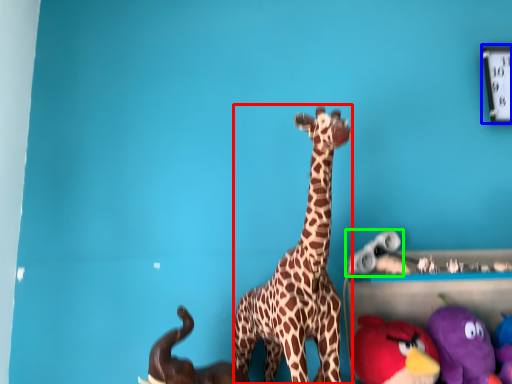
Question: Based on their relative distances, which object is nearer to giraffe (highlighted by a red box)? Choose from clock (highlighted by a blue box) and toy (highlighted by a green box).

Choices:
 (A) clock
 (B) toy

Answer: (B)